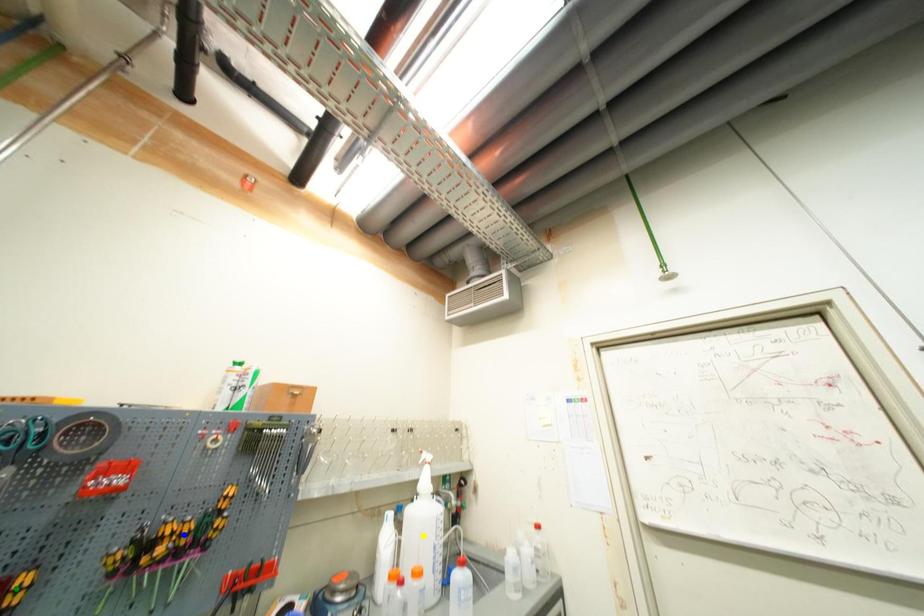
Order these from nearest to farthest:
blue point | yellow point | green point

1. yellow point
2. blue point
3. green point